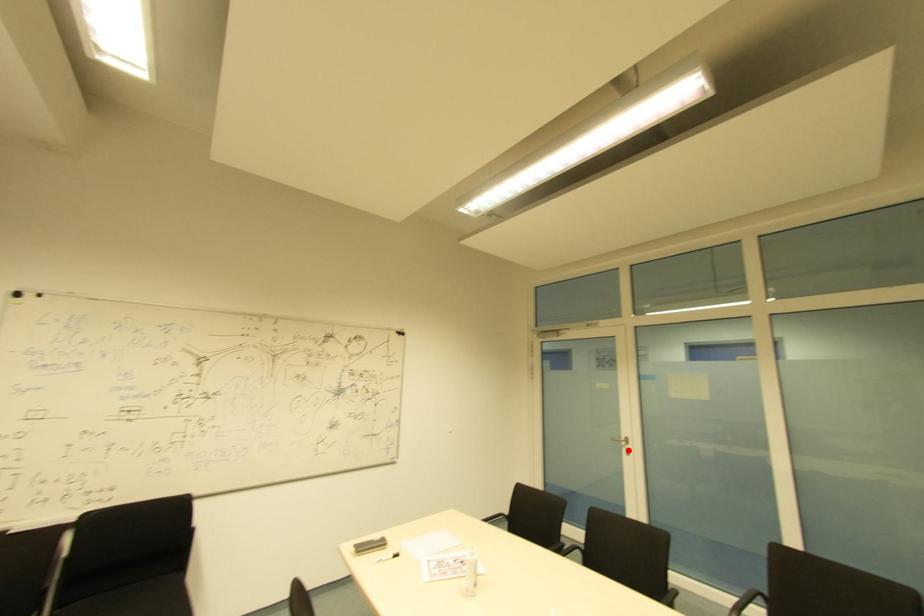
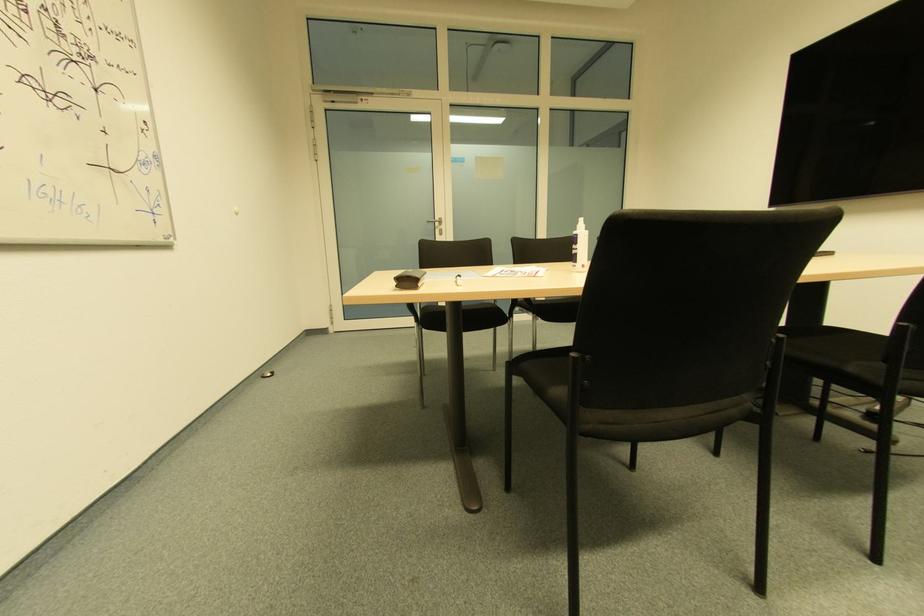
Question: A red point is marked in image1. In image2, is the corresponding 3D point closer to the camera or farther? Reply with the corresponding letter.

Choices:
 (A) The corresponding 3D point is closer.
 (B) The corresponding 3D point is farther.

Answer: (A)